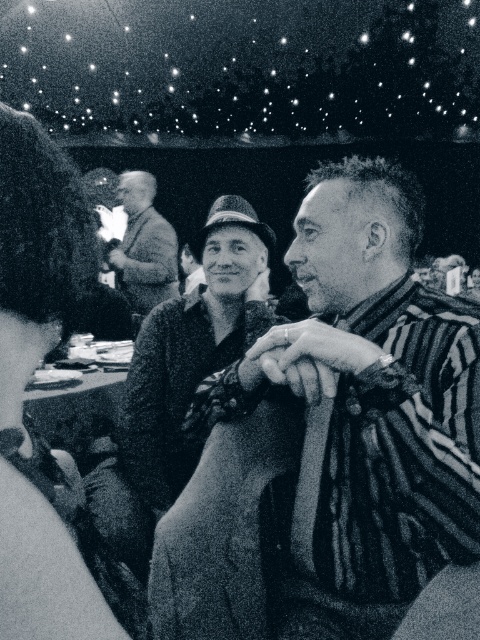
Which is below, striped sweater at center or smooth fabric napkin at left?

smooth fabric napkin at left is lower down.

Which of these two, striped sweater at center or smooth fabric napkin at left, stands shorter?

With less height is smooth fabric napkin at left.

Based on the photo, who is more forward, (271, 515) or (13, 513)?

Point (13, 513) is in front.

Identify the location of striped sweater at center. (332, 438).

Which is below, smooth fabric napkin at left or light brown textured sweater at center?

smooth fabric napkin at left is lower down.

Is smooth fabric napkin at left further to camera compared to light brown textured sweater at center?

No, it is not.

Is point (13, 605) less distant than point (143, 186)?

Yes, it is.

Identify the location of smooth fabric napkin at left. (32, 372).

Does striped sweater at center come in front of light brown textured sweater at center?

Yes, it is in front of light brown textured sweater at center.

Between striped sweater at center and light brown textured sweater at center, which one is positioned higher?

light brown textured sweater at center

Which is behind, point (259, 621) or point (155, 224)?

The point (155, 224) is more distant.

Where is `striped sweater at center`? striped sweater at center is located at coordinates (332, 438).